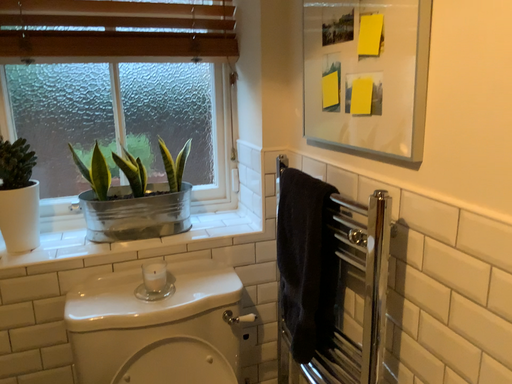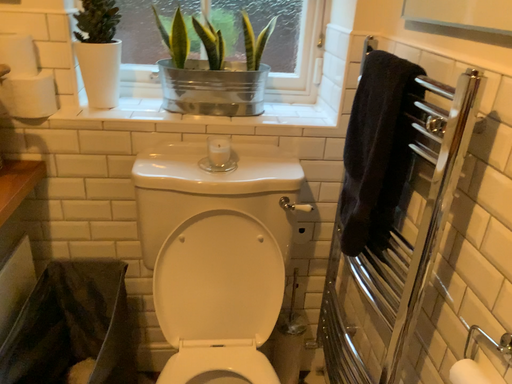
Question: Which way did the camera rotate in the video?

Choices:
 (A) rotated downward
 (B) rotated upward

Answer: (A)